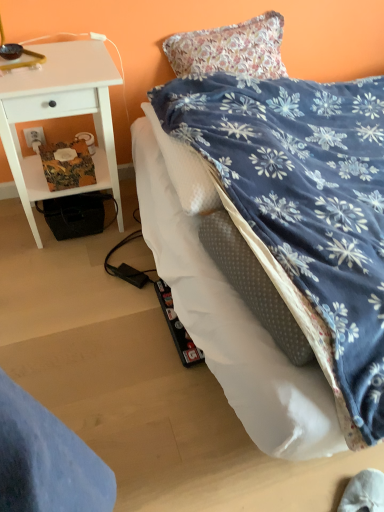
At what (x,y) coordinates should I click in order to perform the action: click on unoccupied area in front of white wood desk at left. Please return your answer as a coordinate pair (x, y). Looking at the image, I should click on (66, 282).